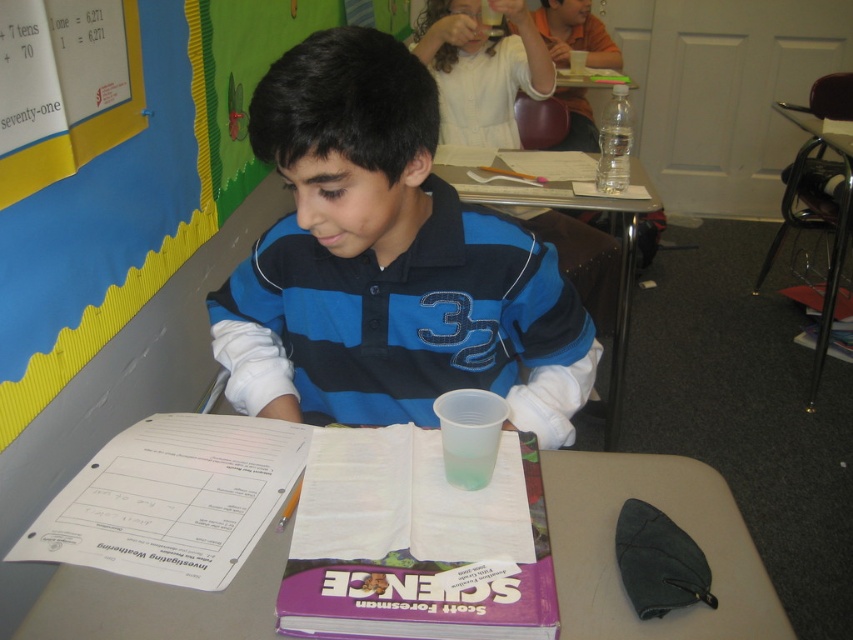
You are a student in the classroom. You need to place a small book between the blue striped polo shirt at center and the translucent plastic cup at center on the desk. Where should you place it?

You should place the small book between the blue striped polo shirt at center and the translucent plastic cup at center on the desk, to the right of the blue striped polo shirt at center and to the left of the translucent plastic cup at center.

You are a student sitting at your desk in the classroom. You notice two points marked on the worksheet titled Investigating Weathering. The first point is at coordinates point [26,234] and the second is at point [361,502]. If you want to touch the point that is closer to you, which coordinate should you reach for?

Point [361,502] is closer to you than point [26,234], so you should reach for point [361,502].

You are a student in the classroom looking at the desk. Which object is placed above the other between the yellow paper at upper left and the purple matte book at center?

The yellow paper at upper left is positioned over the purple matte book at center.